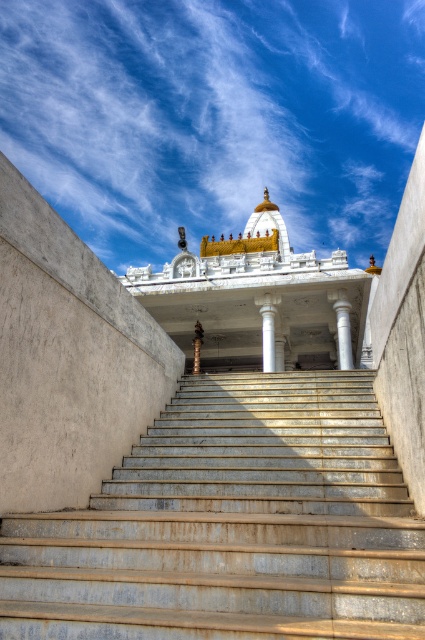
You are standing at the bottom of the grand staircase leading to the temple. You notice a point marked at coordinates (342, 326). Which object does this point correspond to?

The point at coordinates (342, 326) corresponds to the white marble pillar at center.

You are standing at the base of the grand staircase leading to the temple. There are two points marked on the temple structure. One is at coordinate point (343, 356) and the other at point (274, 307). Which point is closer to you as you face the temple?

Point (343, 356) is closer to the viewer than point (274, 307).

You are a photographer planning to capture the white marble temple at center and the white marble pillar at center from the bottom of the staircase. Which object will appear higher in your photo?

The white marble temple at center is located above the white marble pillar at center, so it will appear higher in the photo.